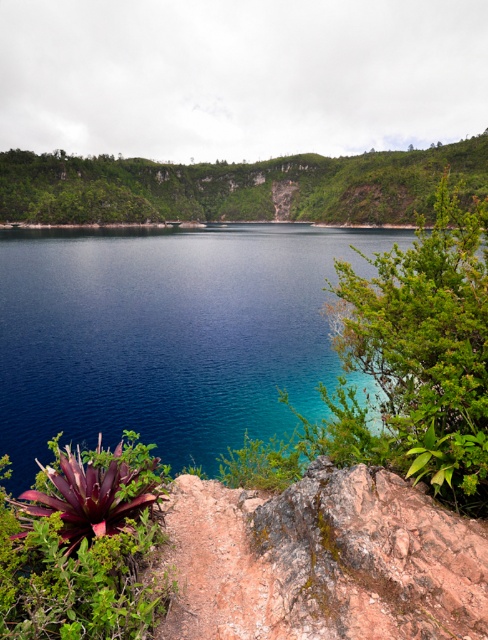
Can you confirm if green leafy hillside at upper center is positioned to the left of leathery purple bromeliad at lower left?

Correct, you'll find green leafy hillside at upper center to the left of leathery purple bromeliad at lower left.

Can you confirm if green leafy hillside at upper center is positioned above leathery purple bromeliad at lower left?

Yes, green leafy hillside at upper center is above leathery purple bromeliad at lower left.

Image resolution: width=488 pixels, height=640 pixels. What do you see at coordinates (238, 186) in the screenshot?
I see `green leafy hillside at upper center` at bounding box center [238, 186].

Where is `green leafy hillside at upper center`? This screenshot has width=488, height=640. green leafy hillside at upper center is located at coordinates (238, 186).

Looking at this image, does blue water at center have a larger size compared to green leafy hillside at upper center?

Actually, blue water at center might be smaller than green leafy hillside at upper center.

Is blue water at center smaller than green leafy hillside at upper center?

Indeed, blue water at center has a smaller size compared to green leafy hillside at upper center.

Between point (147, 365) and point (210, 200), which one is positioned behind?

The point (210, 200) is more distant.

Image resolution: width=488 pixels, height=640 pixels. What are the coordinates of `blue water at center` in the screenshot? It's located at (167, 333).

Does blue water at center have a lesser height compared to leathery purple bromeliad at lower left?

Incorrect, blue water at center's height does not fall short of leathery purple bromeliad at lower left's.

Between point (151, 433) and point (12, 561), which one is positioned in front?

Positioned in front is point (12, 561).

Where is `blue water at center`? This screenshot has height=640, width=488. blue water at center is located at coordinates (167, 333).